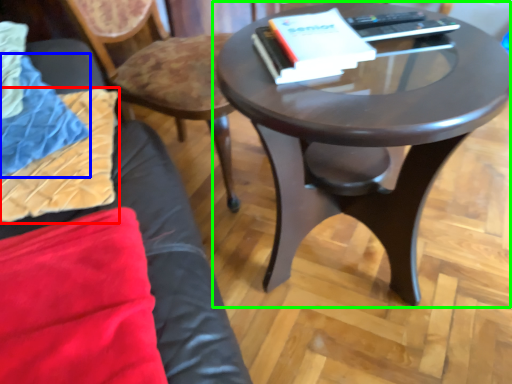
Question: Based on their relative distances, which object is nearer to pillow (highlighted by a red box)? Choose from blanket (highlighted by a blue box) and coffee table (highlighted by a green box).

Choices:
 (A) blanket
 (B) coffee table

Answer: (A)